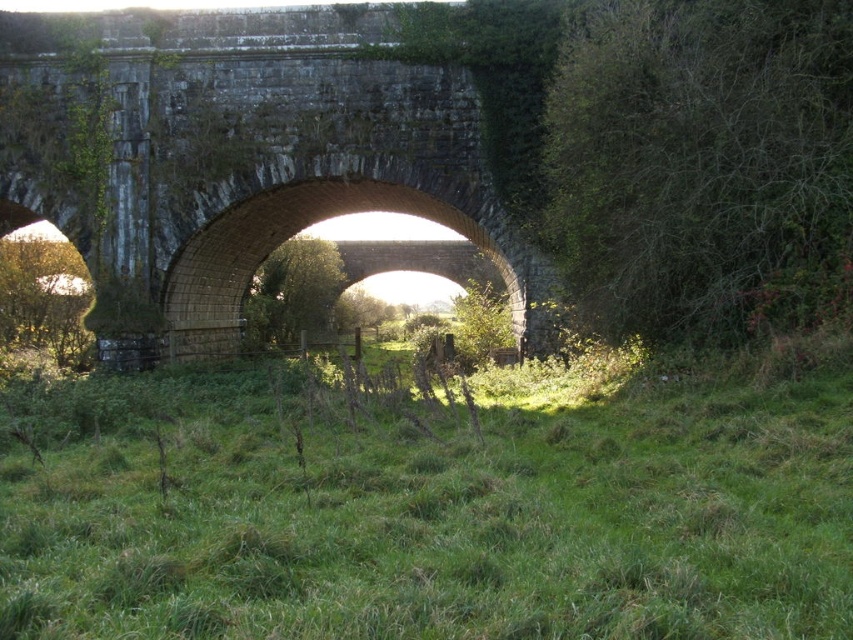
You are standing in the middle of the green grassy field at center and want to walk to the dark gray stone bridge at center. Which direction should you move to reach the bridge?

Since the green grassy field at center is in front of the dark gray stone bridge at center, you should move backward to reach the bridge.

From the picture: You are a landscape architect planning to add a new pathway in the rural scene. The pathway must be placed between the green grassy field at center and the dark gray stone bridge at center. Considering their sizes, which area should the pathway be closer to?

The pathway should be closer to the green grassy field at center because it is smaller than the dark gray stone bridge at center, allowing for better spatial balance.